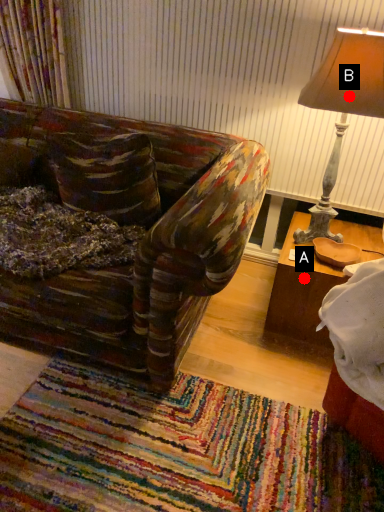
Question: Two points are circled on the image, labeled by A and B beside each circle. Which point appears farthest from the camera in this image?

Choices:
 (A) A is further
 (B) B is further

Answer: (A)